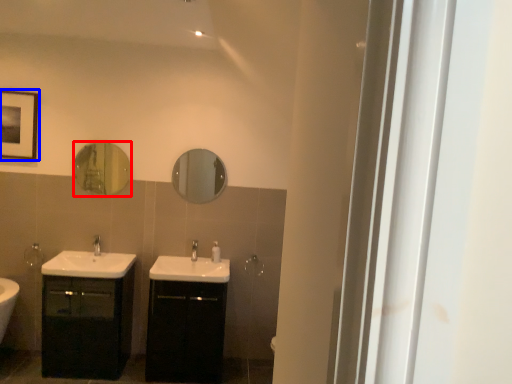
Question: Which object is further to the camera taking this photo, mirror (highlighted by a red box) or picture frame (highlighted by a blue box)?

Choices:
 (A) mirror
 (B) picture frame

Answer: (A)